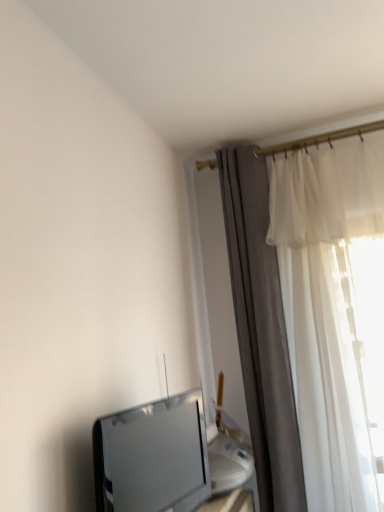
Question: Considering the relative sizes of matte silver tv at lower left and silky white curtain at right in the image provided, is matte silver tv at lower left wider than silky white curtain at right?

Choices:
 (A) yes
 (B) no

Answer: (B)

Question: Is matte silver tv at lower left behind silky white curtain at right?

Choices:
 (A) yes
 (B) no

Answer: (B)

Question: Is matte silver tv at lower left smaller than silky white curtain at right?

Choices:
 (A) no
 (B) yes

Answer: (B)

Question: Considering the relative positions of matte silver tv at lower left and silky white curtain at right in the image provided, is matte silver tv at lower left to the left of silky white curtain at right from the viewer's perspective?

Choices:
 (A) yes
 (B) no

Answer: (A)

Question: Does matte silver tv at lower left appear on the right side of silky white curtain at right?

Choices:
 (A) no
 (B) yes

Answer: (A)

Question: Is the surface of matte silver tv at lower left in direct contact with silky white curtain at right?

Choices:
 (A) no
 (B) yes

Answer: (A)

Question: Is silky white curtain at right aimed at matte silver tv at lower left?

Choices:
 (A) yes
 (B) no

Answer: (A)

Question: From the image's perspective, would you say silky white curtain at right is shown under matte silver tv at lower left?

Choices:
 (A) no
 (B) yes

Answer: (A)

Question: Is silky white curtain at right at the left side of matte silver tv at lower left?

Choices:
 (A) no
 (B) yes

Answer: (A)

Question: Can you confirm if silky white curtain at right is positioned to the right of matte silver tv at lower left?

Choices:
 (A) no
 (B) yes

Answer: (B)

Question: Considering the relative sizes of silky white curtain at right and matte silver tv at lower left in the image provided, is silky white curtain at right taller than matte silver tv at lower left?

Choices:
 (A) yes
 (B) no

Answer: (A)

Question: Considering the relative sizes of silky white curtain at right and matte silver tv at lower left in the image provided, is silky white curtain at right bigger than matte silver tv at lower left?

Choices:
 (A) no
 (B) yes

Answer: (B)

Question: Would you say matte silver tv at lower left is inside or outside silky white curtain at right?

Choices:
 (A) outside
 (B) inside

Answer: (A)